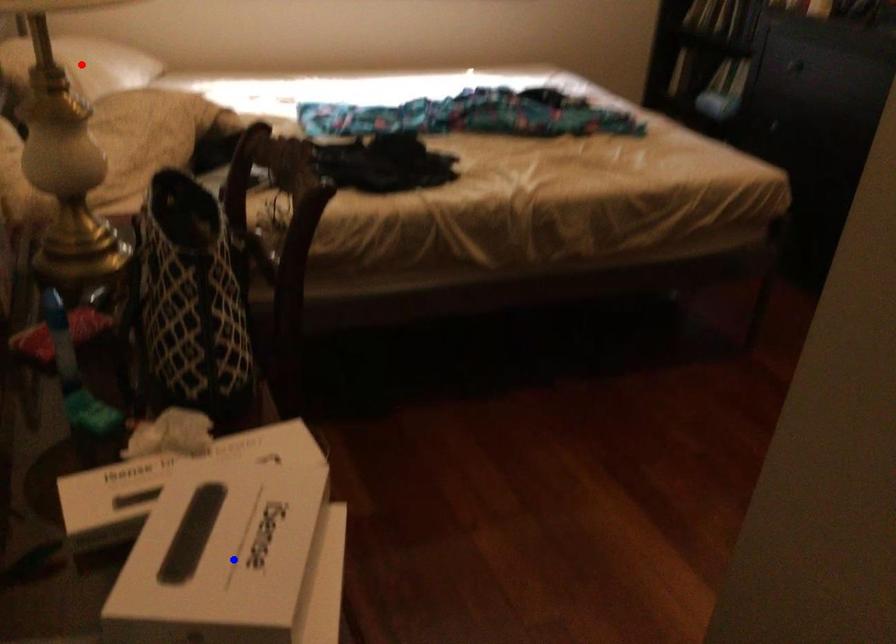
Question: In the image, two points are highlighted. Which point is nearer to the camera? Reply with the corresponding letter.

Choices:
 (A) blue point
 (B) red point

Answer: (A)